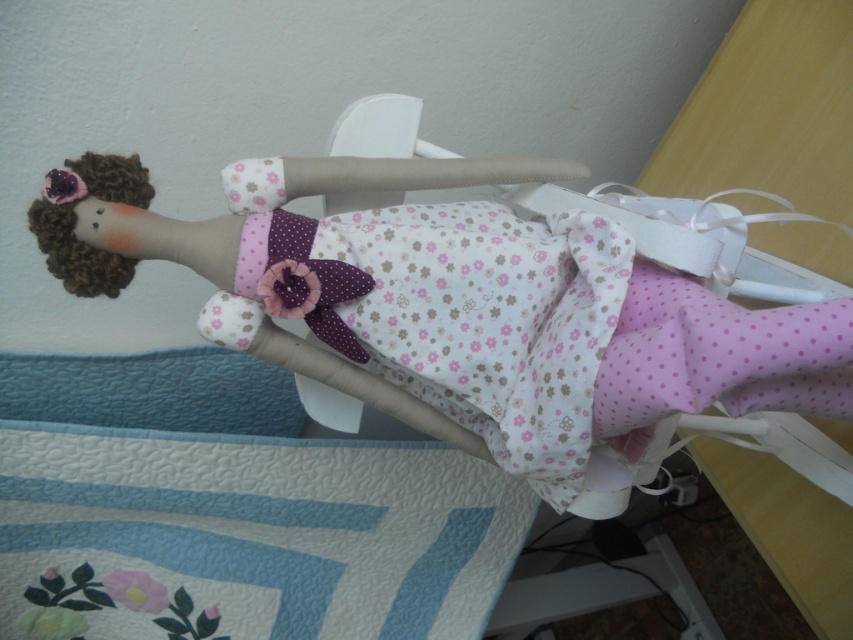
Question: Among these objects, which one is nearest to the camera?

Choices:
 (A) fluffy fabric doll at center
 (B) blue quilted fabric at lower left

Answer: (A)

Question: Is fluffy fabric doll at center thinner than blue quilted fabric at lower left?

Choices:
 (A) yes
 (B) no

Answer: (A)

Question: Does fluffy fabric doll at center have a smaller size compared to blue quilted fabric at lower left?

Choices:
 (A) no
 (B) yes

Answer: (B)

Question: In this image, where is fluffy fabric doll at center located relative to blue quilted fabric at lower left?

Choices:
 (A) right
 (B) left

Answer: (A)

Question: Among these points, which one is farthest from the camera?

Choices:
 (A) (434, 515)
 (B) (306, 253)

Answer: (A)

Question: Which point is closer to the camera?

Choices:
 (A) blue quilted fabric at lower left
 (B) fluffy fabric doll at center

Answer: (B)